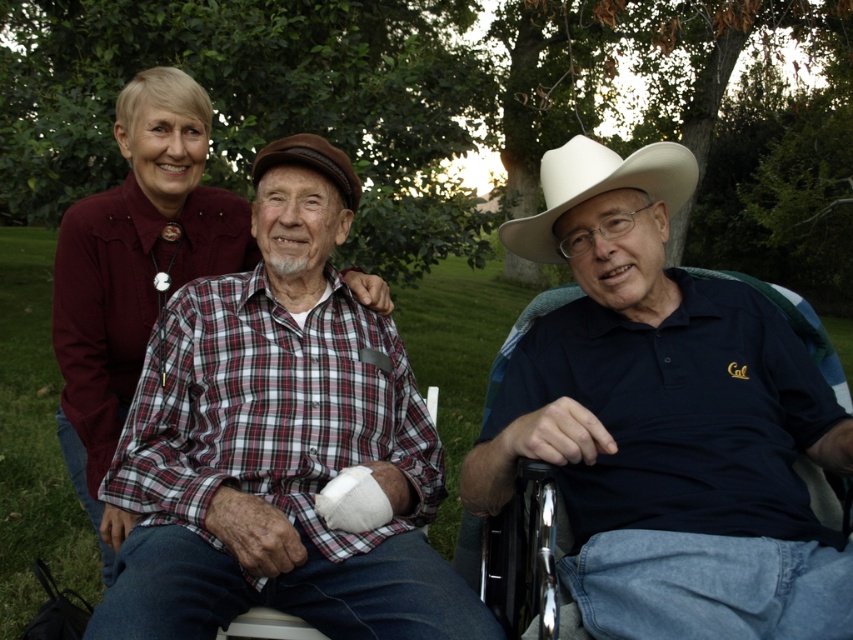
Between white matte cowboy hat at upper center and plaid cotton shirt at center, which one is positioned higher?

white matte cowboy hat at upper center is higher up.

Image resolution: width=853 pixels, height=640 pixels. Describe the element at coordinates (666, 420) in the screenshot. I see `white matte cowboy hat at upper center` at that location.

Does point (746, 388) come behind point (143, 541)?

Yes, point (746, 388) is farther from viewer.

This screenshot has height=640, width=853. I want to click on white matte cowboy hat at upper center, so click(666, 420).

Is plaid cotton shirt at center further to the viewer compared to white felt cowboy hat at center?

No, it is in front of white felt cowboy hat at center.

From the picture: Does plaid cotton shirt at center have a greater width compared to white felt cowboy hat at center?

Indeed, plaid cotton shirt at center has a greater width compared to white felt cowboy hat at center.

This screenshot has height=640, width=853. Identify the location of plaid cotton shirt at center. (280, 444).

Is white matte cowboy hat at upper center below white felt cowboy hat at center?

Correct, white matte cowboy hat at upper center is located below white felt cowboy hat at center.

Is white matte cowboy hat at upper center smaller than white felt cowboy hat at center?

No.

Which is in front, point (596, 374) or point (575, 172)?

Point (596, 374)

Locate an element on the screen. The height and width of the screenshot is (640, 853). white matte cowboy hat at upper center is located at coordinates (666, 420).